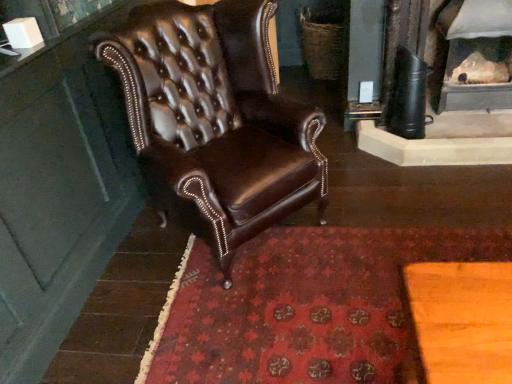
At what (x,y) coordinates should I click in order to perform the action: click on vacant space to the right of brown leather chair at center. Please return your answer as a coordinate pair (x, y). Looking at the image, I should click on [369, 218].